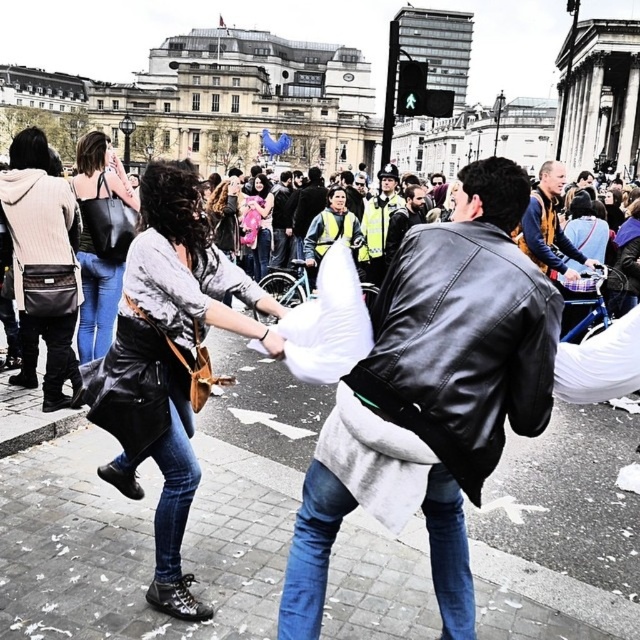
You are a delivery rider who just arrived at the plaza. You need to park your motorcycle near the smooth concrete pavement at center. However, there is a reflective silver helmet at center in the way. Can you park your motorcycle there without moving the helmet?

The smooth concrete pavement at center is in front of the reflective silver helmet at center, meaning the helmet is blocking the parking spot. Therefore, you cannot park your motorcycle there without moving the helmet.